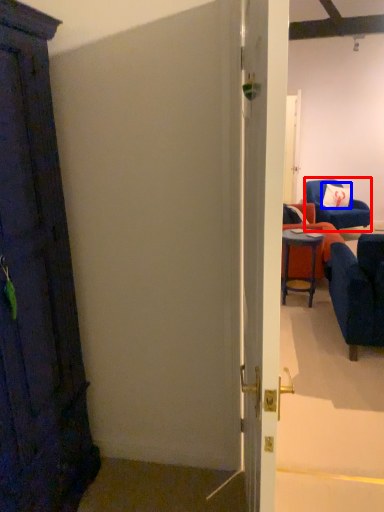
Question: Which point is further to the camera, chair (highlighted by a red box) or pillow (highlighted by a blue box)?

Choices:
 (A) chair
 (B) pillow

Answer: (B)